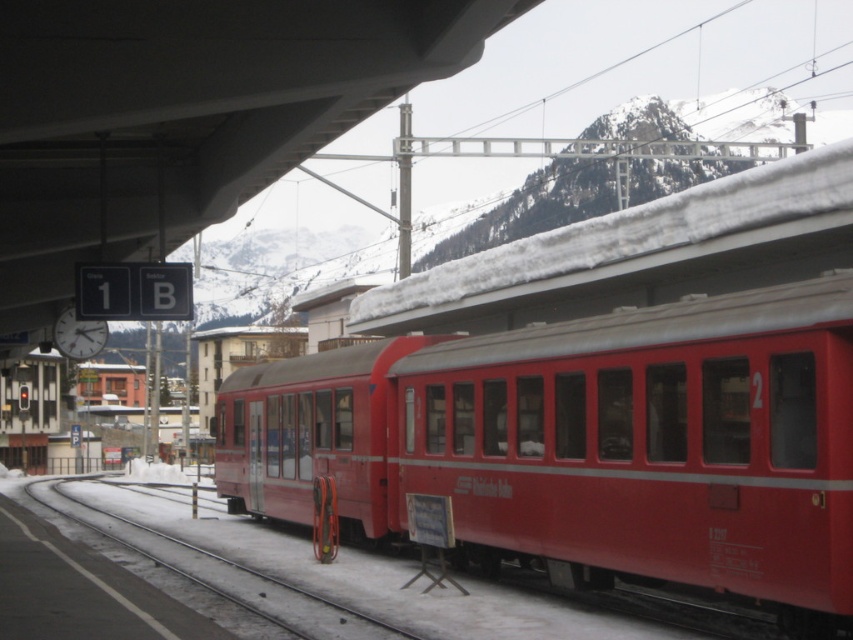
Question: Is matte red train at center closer to the viewer compared to metallic red track at lower center?

Choices:
 (A) no
 (B) yes

Answer: (B)

Question: Which point appears closest to the camera in this image?

Choices:
 (A) (637, 572)
 (B) (100, 509)

Answer: (A)

Question: Considering the relative positions of matte red train at center and metallic red track at lower center in the image provided, where is matte red train at center located with respect to metallic red track at lower center?

Choices:
 (A) left
 (B) right

Answer: (B)

Question: Does matte red train at center come in front of metallic red track at lower center?

Choices:
 (A) no
 (B) yes

Answer: (B)

Question: Which object is farther from the camera taking this photo?

Choices:
 (A) metallic red track at lower center
 (B) matte red train at center

Answer: (A)